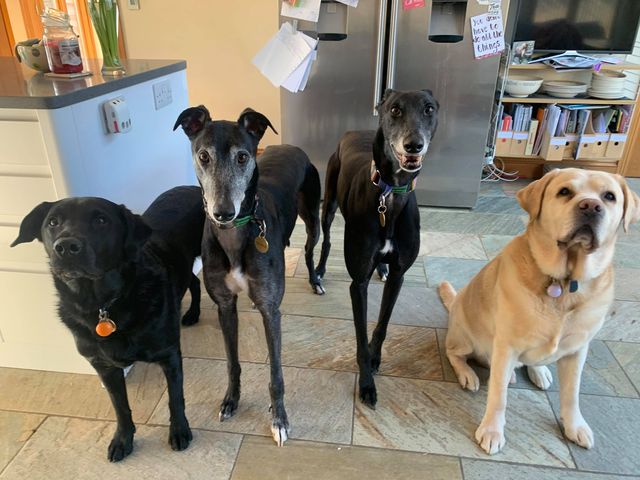
Find the location of a particular element. This screenshot has height=480, width=640. counter is located at coordinates (100, 154).